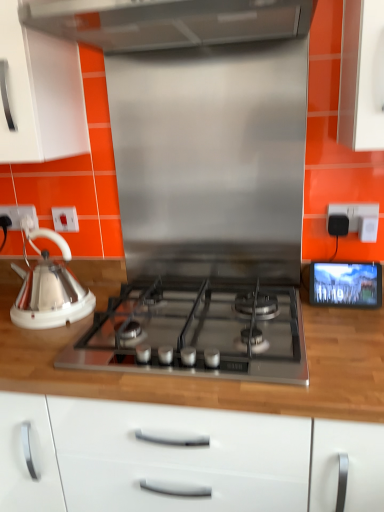
Question: Is black plastic electric outlet at upper right, which ranks as the third electric outlet in left-to-right order, in front of or behind wooden at left in the image?

Choices:
 (A) behind
 (B) front

Answer: (A)

Question: In terms of width, does black plastic electric outlet at upper right, which ranks as the third electric outlet in left-to-right order, look wider or thinner when compared to wooden at left?

Choices:
 (A) thin
 (B) wide

Answer: (A)

Question: Considering the real-world distances, which object is farthest from the matte black screen at right?

Choices:
 (A) white plastic electrical outlet at left, which appears as the second electric outlet when viewed from the front
 (B) white glossy kettle at left
 (C) white plastic socket at left, which is the third electric outlet in right-to-left order
 (D) satin silver gas stove at center
 (E) black plastic electric outlet at upper right, which ranks as the third electric outlet in left-to-right order

Answer: (C)

Question: Which of these objects is positioned farthest from the white glossy kettle at left?

Choices:
 (A) matte black screen at right
 (B) wooden at left
 (C) satin silver gas stove at center
 (D) white plastic socket at left, acting as the 1th electric outlet starting from the left
 (E) black plastic electric outlet at upper right, the 3th electric outlet when ordered from back to front

Answer: (E)